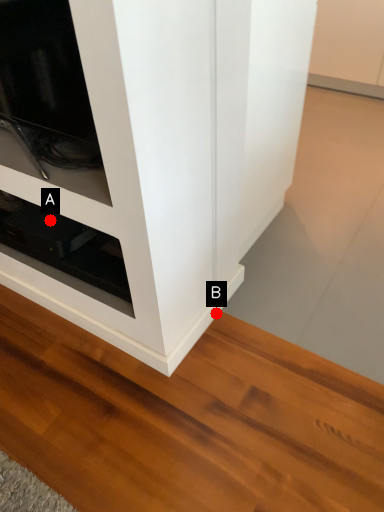
Question: Two points are circled on the image, labeled by A and B beside each circle. Which point appears farthest from the camera in this image?

Choices:
 (A) A is further
 (B) B is further

Answer: (B)